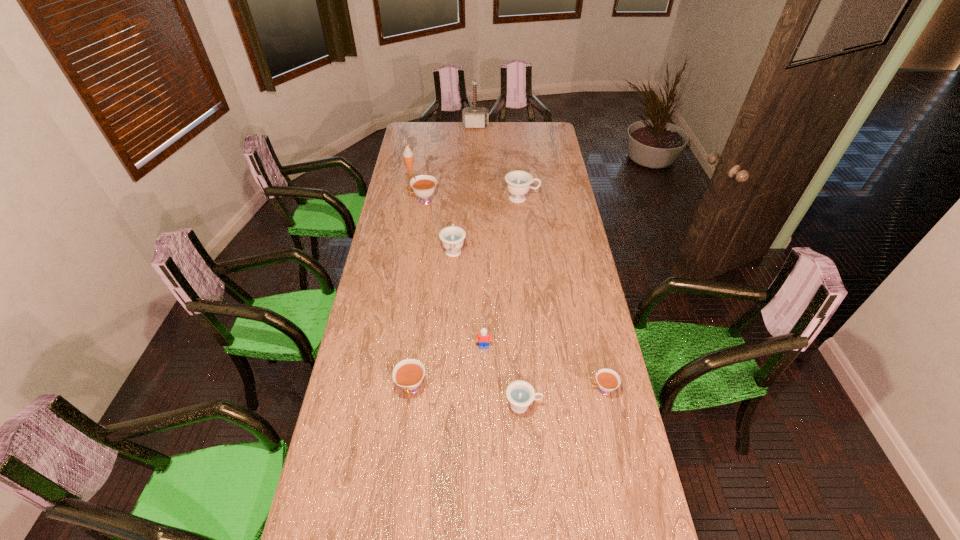
Identify the location of object at the right edge. (608, 380).

The height and width of the screenshot is (540, 960). I want to click on free space at the left edge, so click(351, 431).

Identify the location of vacant space at the right edge. Image resolution: width=960 pixels, height=540 pixels. (535, 165).

This screenshot has height=540, width=960. In order to click on free space at the far right corner of the desktop in this screenshot , I will do `click(530, 122)`.

Identify the location of empty location between the smallest white teacup and the biggest white teacup. (513, 295).

Where is `vacant area between the Lego and the farthest object`? vacant area between the Lego and the farthest object is located at coordinates (480, 236).

You are a GUI agent. You are given a task and a screenshot of the screen. Output one action in this format:
    pyautogui.click(x=<x>, y=<y>)
    Task: Click on the free space that is in between the farthest white teacup and the second smallest white teacup
    This screenshot has width=960, height=540.
    Given the screenshot: What is the action you would take?
    pyautogui.click(x=418, y=295)

The image size is (960, 540). Identify the location of free spot between the farthest white teacup and the rightmost object. point(513,295).

Identify the location of vacant area that lies between the white Lego and the farthest blue teacup. [x=503, y=273].

Identify the location of empty location between the farthest blue teacup and the nearest blue teacup. (522, 302).